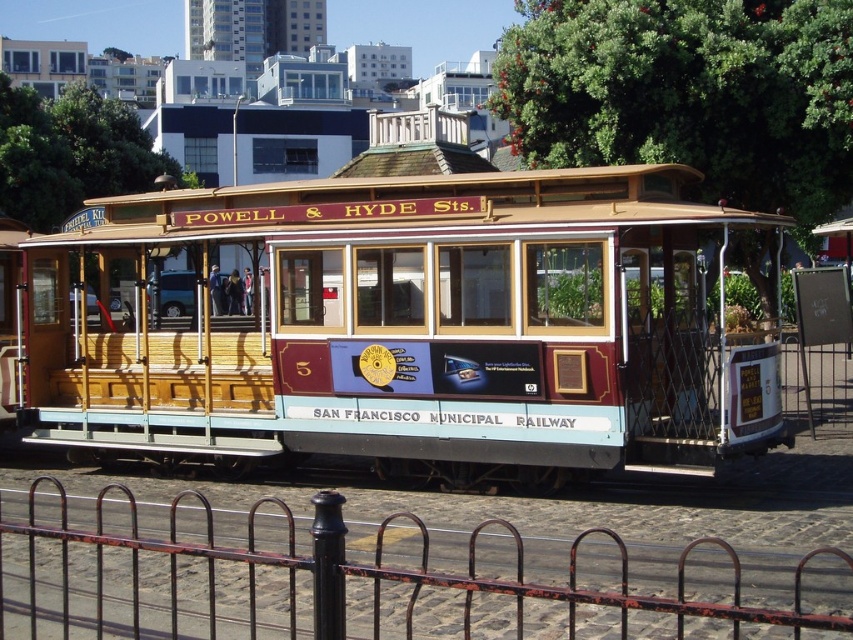
You are standing at point A located at coordinates 0.3, 0.3 in the image. You want to walk to the wooden cable car at center. In which direction should you move relative to your current position?

To reach the wooden cable car at center from point A at (254,192), you should move towards the northeast direction since the cable car is located at coordinates (404,324), which is northeast of your current position.

You are a tourist standing on the sidewalk next to the wooden cable car at center. You want to take a photo of the rusty metal fence at lower center without the cable car blocking it. Is there a way to do this while staying on the sidewalk?

The wooden cable car at center is positioned over the rusty metal fence at lower center, so you can move to the side of the wooden cable car at center to get an unobstructed view of the rusty metal fence at lower center while staying on the sidewalk.